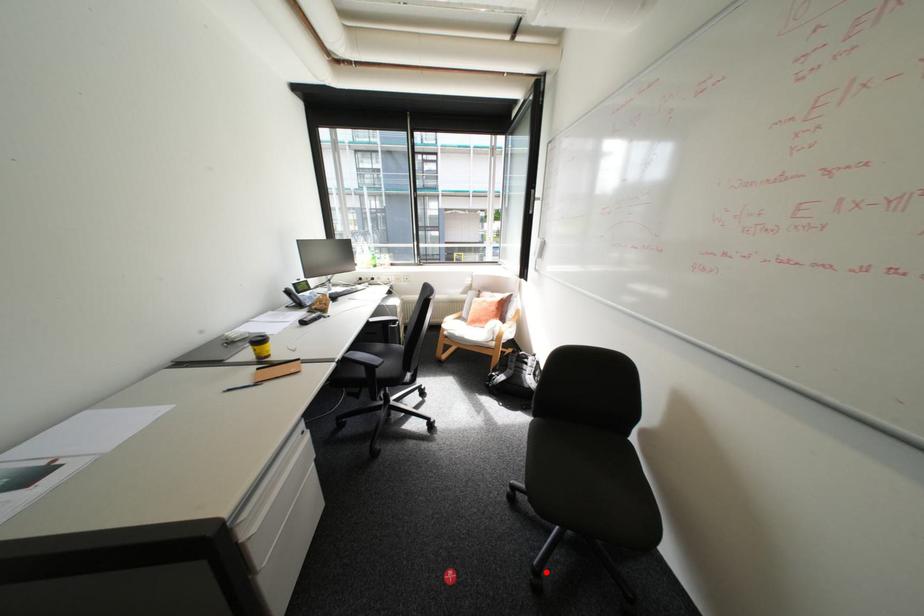
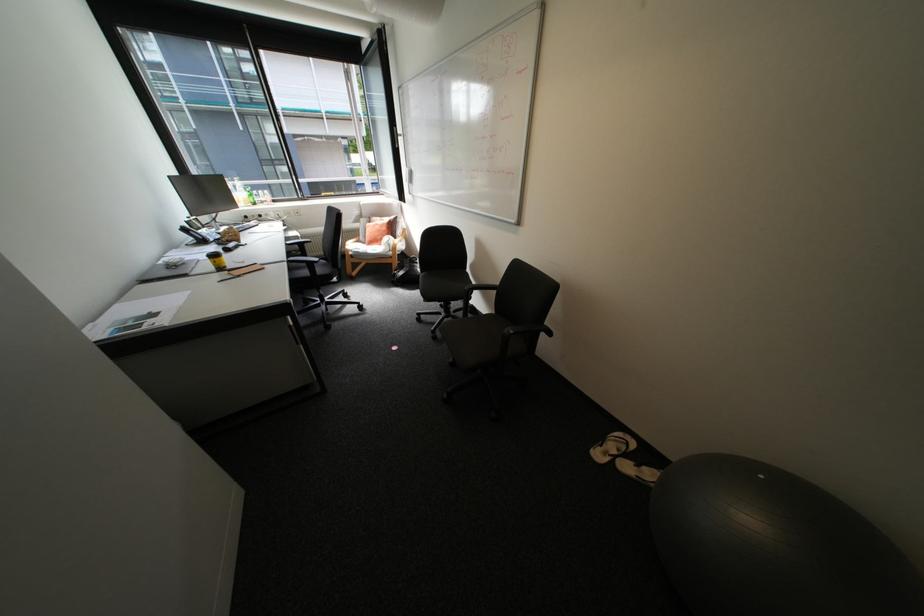
Question: A red point is marked in image1. In image2, is the corresponding 3D point closer to the camera or farther? Reply with the corresponding letter.

Choices:
 (A) The corresponding 3D point is closer.
 (B) The corresponding 3D point is farther.

Answer: (A)